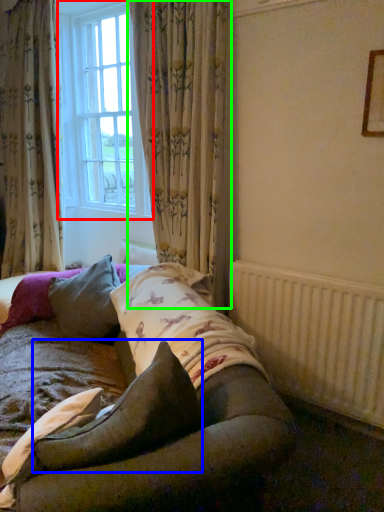
Question: Based on their relative distances, which object is nearer to window (highlighted by a red box)? Choose from pillow (highlighted by a blue box) and curtain (highlighted by a green box).

Choices:
 (A) pillow
 (B) curtain

Answer: (B)